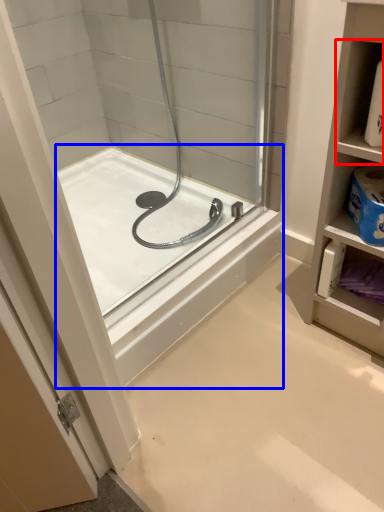
Question: Which object is further to the camera taking this photo, shelf (highlighted by a red box) or bathtub (highlighted by a blue box)?

Choices:
 (A) shelf
 (B) bathtub

Answer: (B)